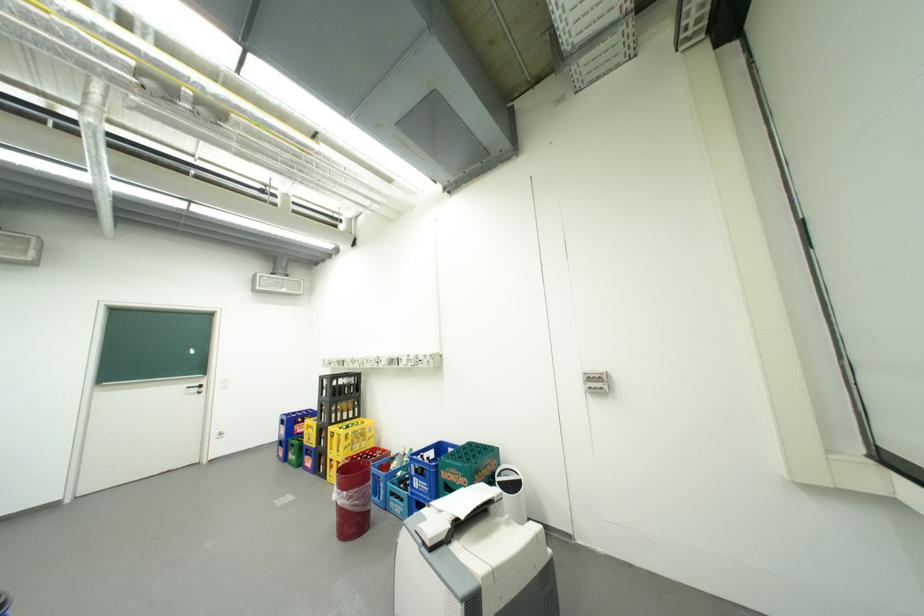
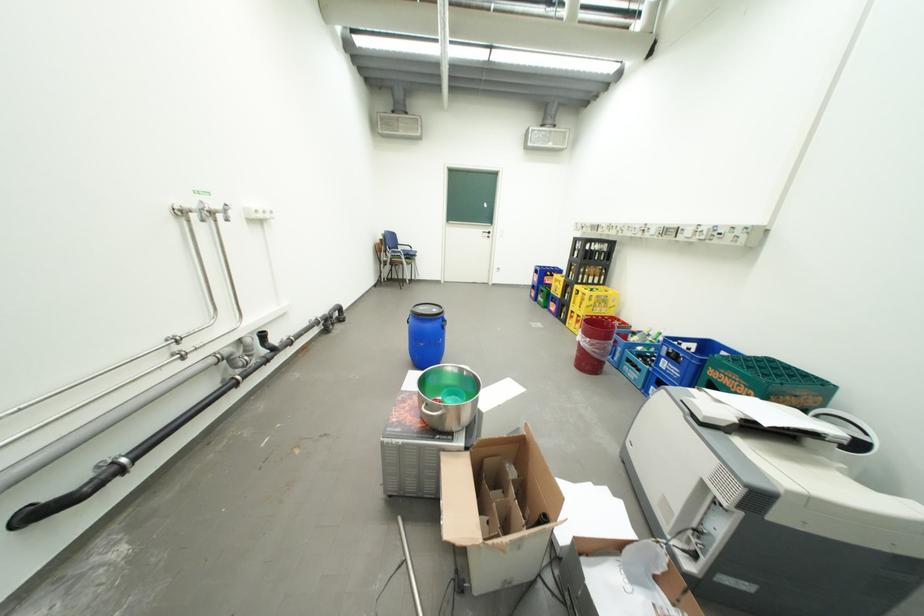
The images are taken continuously from a first-person perspective. In which direction is your viewpoint rotating?

The camera's rotation is toward left-down.